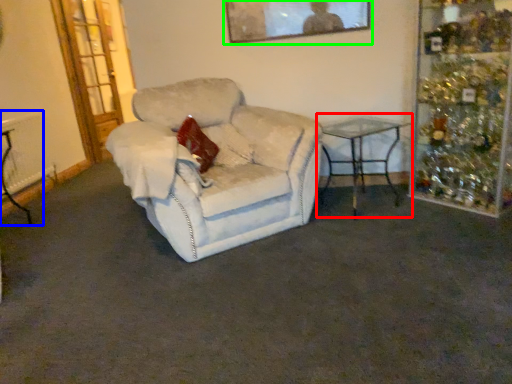
Question: Based on their relative distances, which object is farther from table (highlighted by a red box)? Choose from table (highlighted by a blue box) and picture frame (highlighted by a green box).

Choices:
 (A) table
 (B) picture frame

Answer: (A)